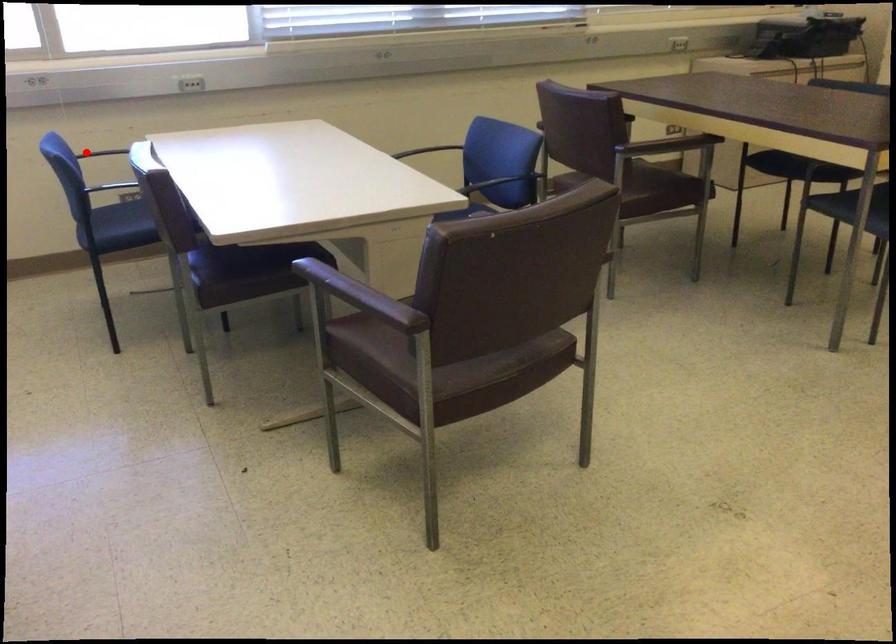
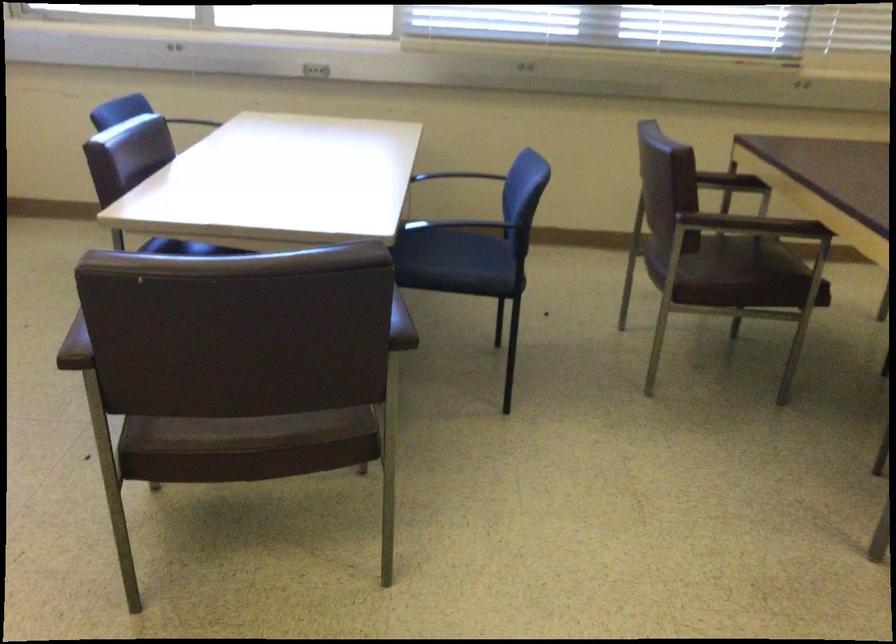
In the second image, find the point that corresponds to the highlighted location in the first image.

(202, 120)